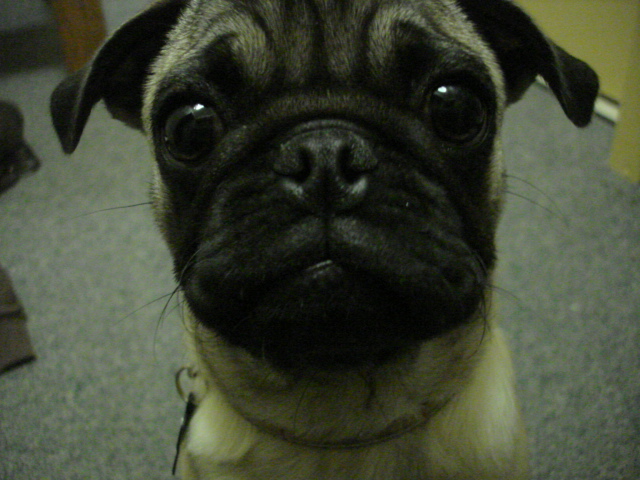
This screenshot has width=640, height=480. Find the location of `brown wooden leg`. brown wooden leg is located at coordinates point(86,35).